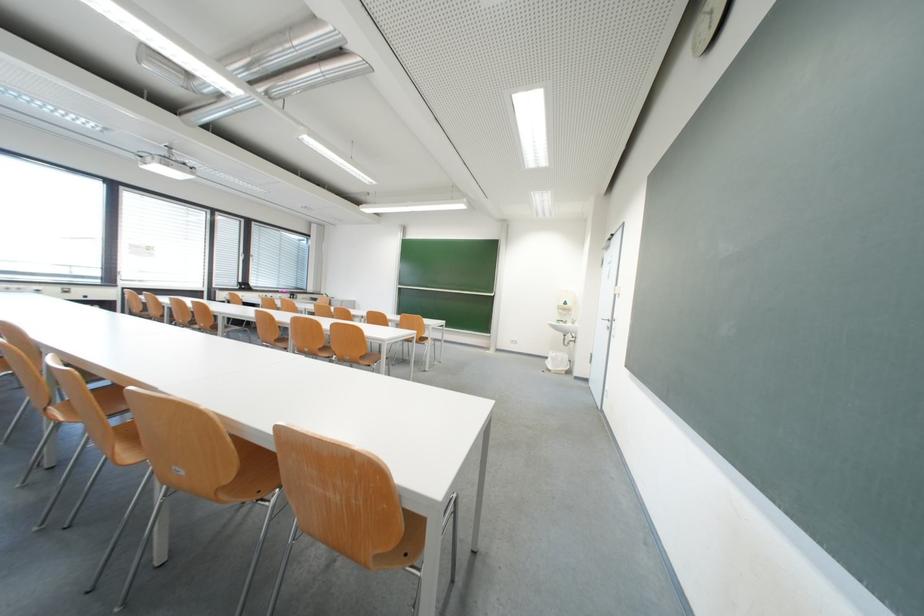
Find where to push the white light switch. Please return your answer as a coordinate pair (x, y).

(513, 341)